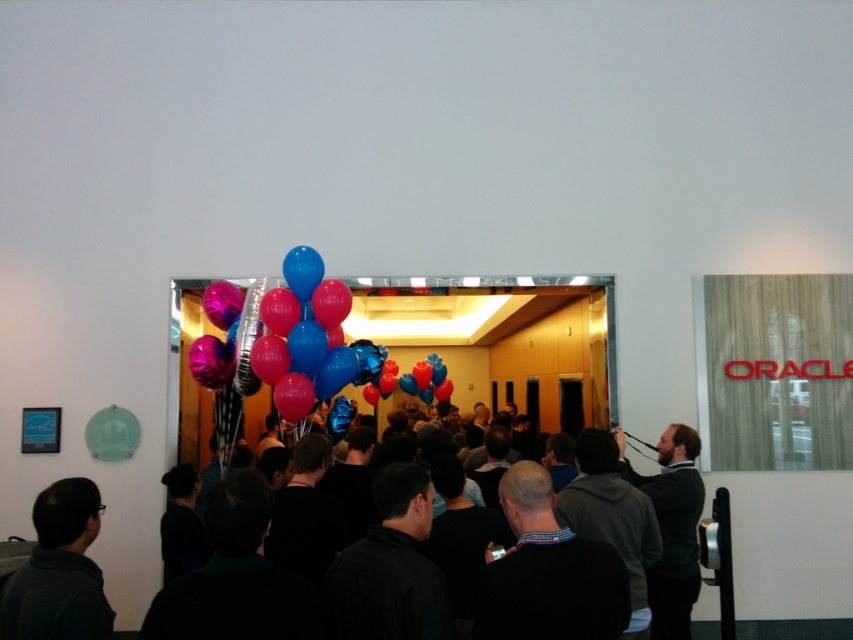
Question: Is dark gray jacket at lower left wider than dark gray clothing at center?

Choices:
 (A) yes
 (B) no

Answer: (B)

Question: Estimate the real-world distances between objects in this image. Which object is farther from the dark gray clothing at center?

Choices:
 (A) shiny metallic balloons at center
 (B) dark gray sweater at right

Answer: (A)

Question: Which object is farther from the camera taking this photo?

Choices:
 (A) shiny metallic balloons at center
 (B) dark gray clothing at center
 (C) dark gray sweater at right

Answer: (A)

Question: In this image, where is dark gray jacket at lower left located relative to dark gray sweater at right?

Choices:
 (A) above
 (B) below

Answer: (A)

Question: Among these points, which one is nearest to the camera?

Choices:
 (A) (64, 484)
 (B) (672, 513)

Answer: (A)

Question: Does dark gray jacket at lower left come behind dark gray sweater at right?

Choices:
 (A) no
 (B) yes

Answer: (A)